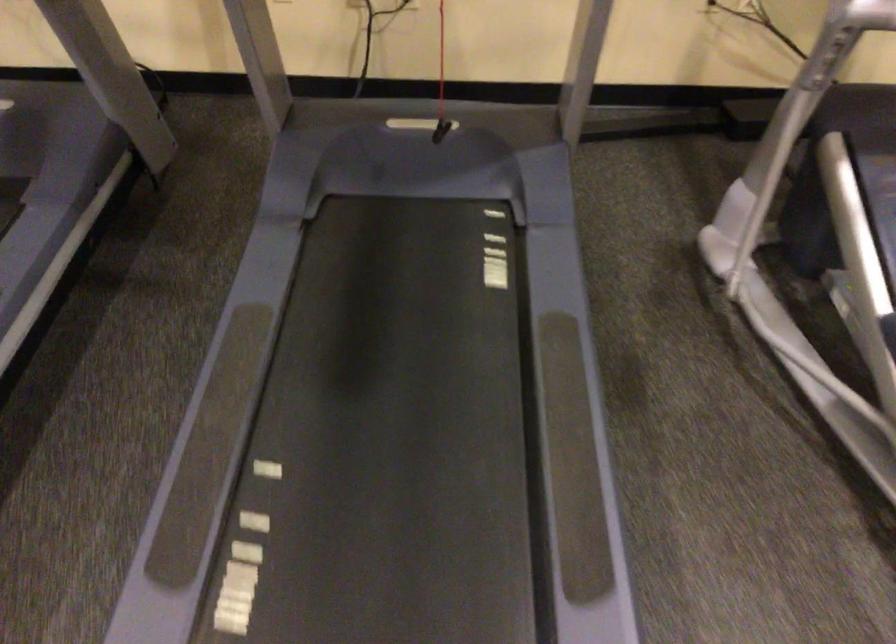
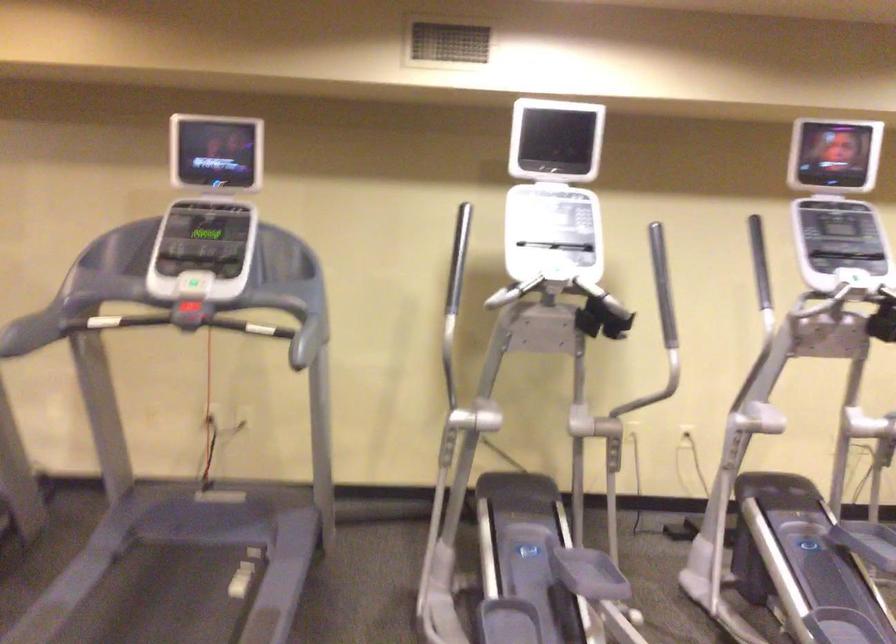
Question: I am providing you with two images of the same scene from different viewpoints. Which of the following objects are not visible in image2?

Choices:
 (A) red safety cord
 (B) white egg carton
 (C) elliptical foot pedal
 (D) red emergency stop

Answer: (A)